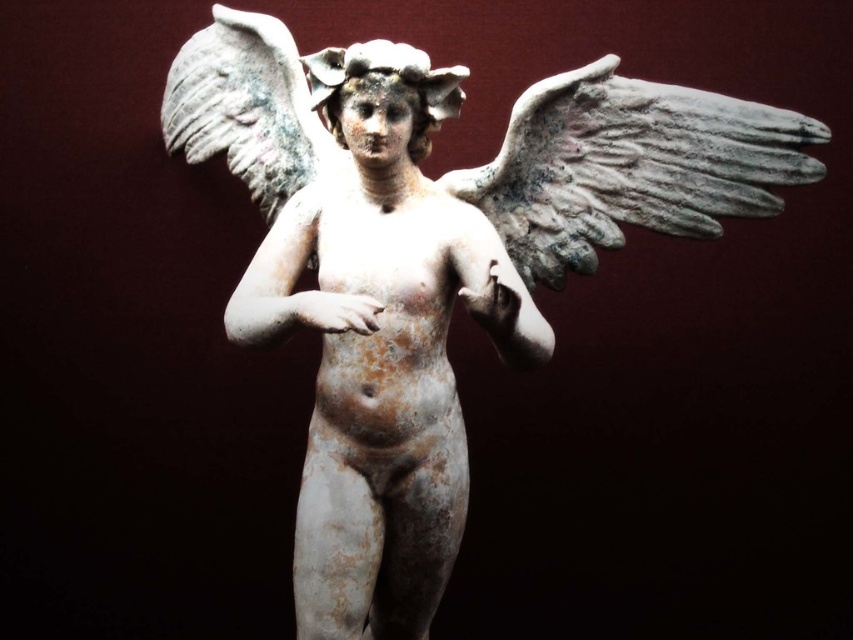
Question: Which object appears closest to the camera in this image?

Choices:
 (A) white stone wing at center
 (B) gray stone wing at center

Answer: (B)

Question: Considering the real-world distances, which object is closest to the white stone cherub at center?

Choices:
 (A) gray stone wing at center
 (B) white stone wing at center

Answer: (B)

Question: Which of the following is the farthest from the observer?

Choices:
 (A) (445, 81)
 (B) (645, 184)

Answer: (B)

Question: Can you confirm if white stone cherub at center is bigger than gray stone wing at center?

Choices:
 (A) no
 (B) yes

Answer: (B)

Question: Does white stone cherub at center appear on the left side of white stone wing at center?

Choices:
 (A) no
 (B) yes

Answer: (B)

Question: Can you confirm if white stone cherub at center is thinner than white stone wing at center?

Choices:
 (A) no
 (B) yes

Answer: (B)